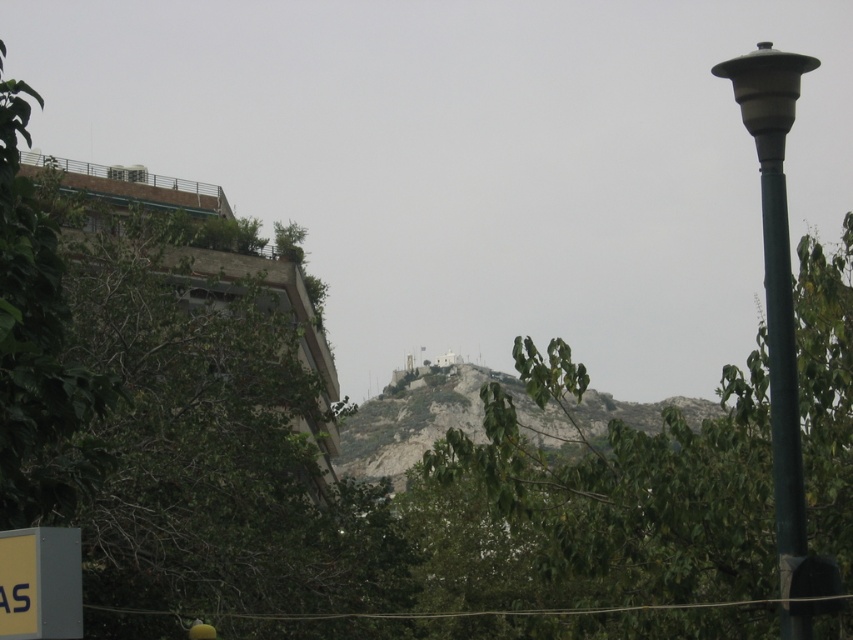
Is rocky gray hillside at center taller than green metallic pole at right?

Correct, rocky gray hillside at center is much taller as green metallic pole at right.

Is point (352, 474) positioned before point (790, 417)?

No.

Describe the element at coordinates (482, 419) in the screenshot. Image resolution: width=853 pixels, height=640 pixels. I see `rocky gray hillside at center` at that location.

Locate an element on the screen. This screenshot has height=640, width=853. rocky gray hillside at center is located at coordinates (482, 419).

Which is more to the left, matte green pole at right or green metallic pole at right?

green metallic pole at right is more to the left.

Which is in front, point (782, 524) or point (804, 637)?

Positioned in front is point (804, 637).

Where is `matte green pole at right`? matte green pole at right is located at coordinates [x=776, y=262].

From the picture: Is green metallic pole at right thinner than gray plastic sign at lower left?

No.

Can you confirm if green metallic pole at right is positioned below gray plastic sign at lower left?

Actually, green metallic pole at right is above gray plastic sign at lower left.

Find the location of a particular element. The width and height of the screenshot is (853, 640). green metallic pole at right is located at coordinates (781, 358).